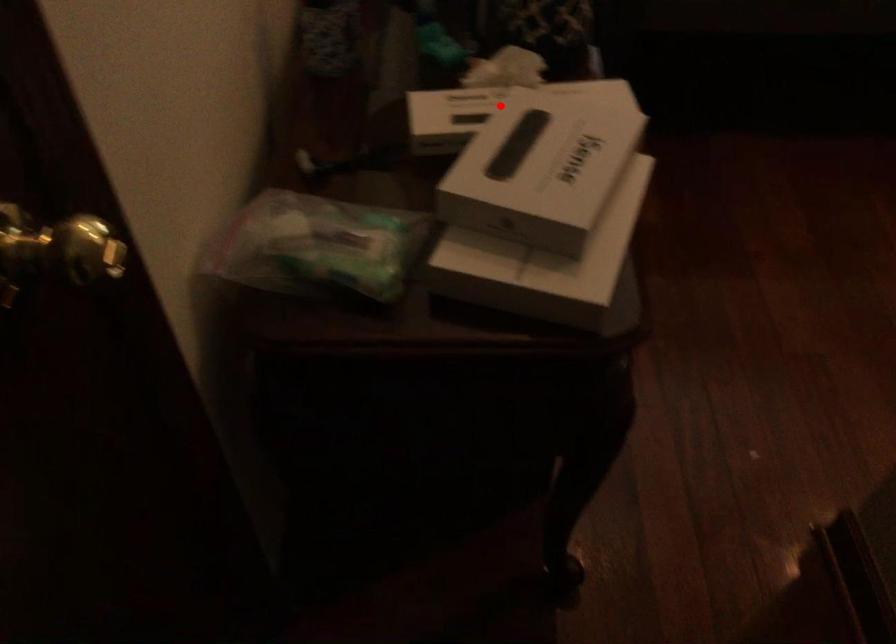
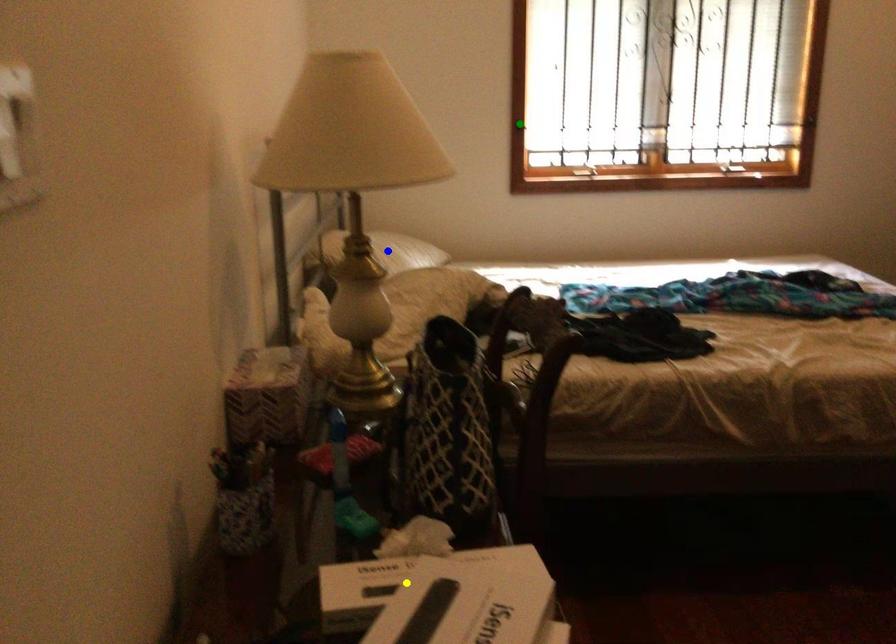
Question: I am providing you with two images of the same scene from different viewpoints. A red point is marked on the first image. You are given multiple points on the second image. Which mark in image 2 goes with the point in image 1?

Choices:
 (A) green point
 (B) blue point
 (C) yellow point

Answer: (C)